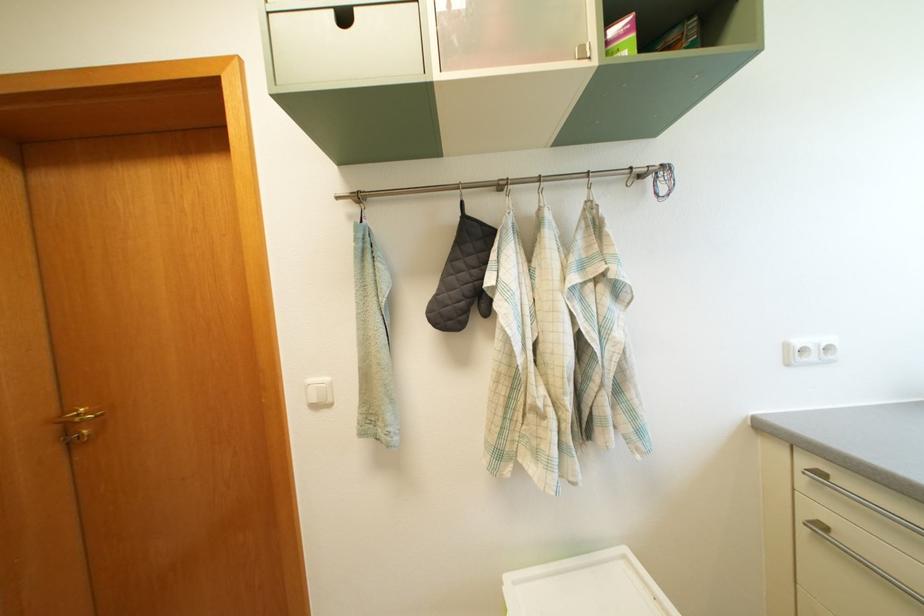
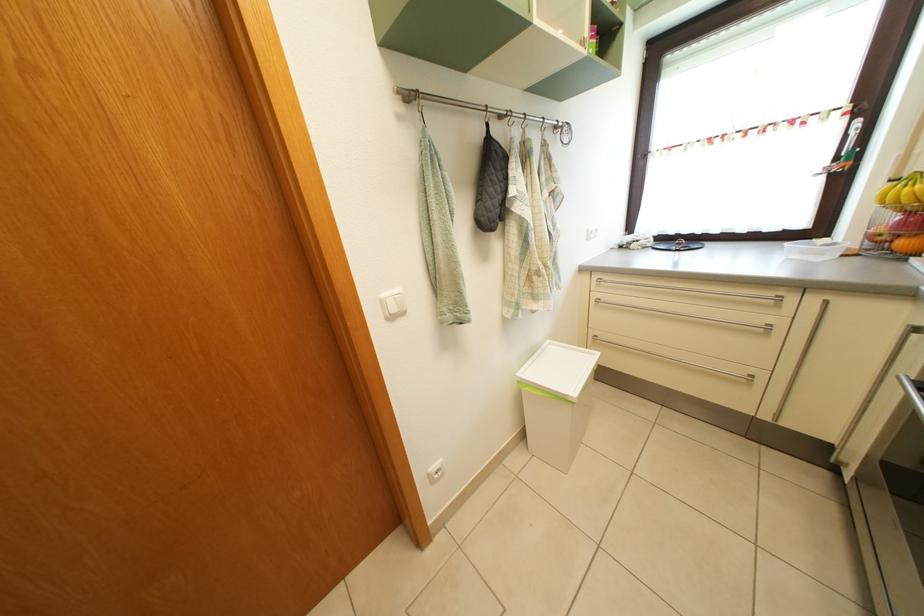
Where in the second image is the point corresponding to the point at 318,387 from the first image?

(392, 302)